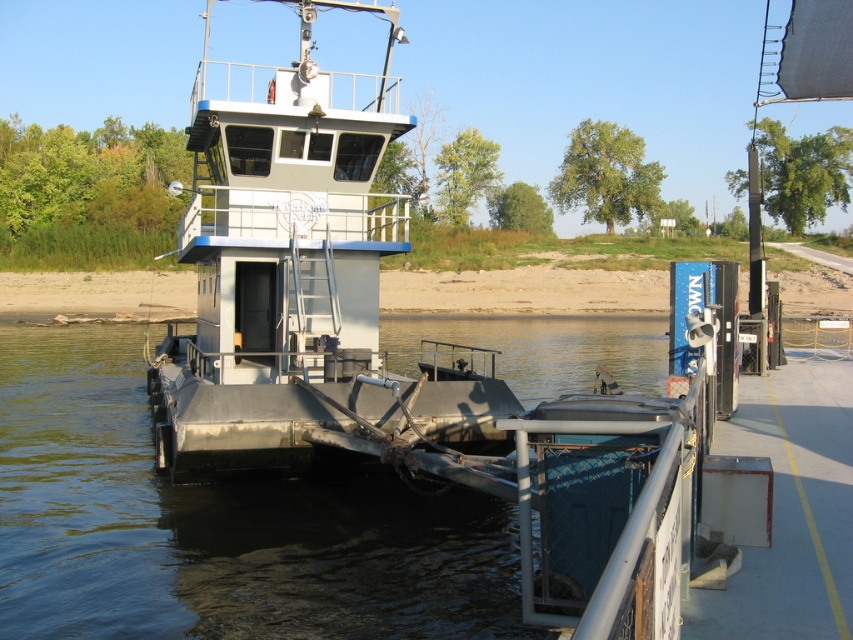
You are standing on the dock and see the metallic water at center and the metallic gray boat at center. Which object is closer to the dock?

The metallic gray boat at center is closer to the dock because the metallic water at center is positioned under it, meaning the boat is above the water and closer to the dock.

Please look at the ferry boat and the dock. There is a point marked at coordinates (x=213, y=524). What is located at that point?

The point at coordinates (x=213, y=524) marks metallic water at center.

You are a passenger on the ferry and want to know if you can safely step from the metallic gray boat at center onto the dock without touching the metallic water at center. Can you do this?

The metallic water at center is not as tall as the metallic gray boat at center, so stepping from the metallic gray boat at center onto the dock is safe as the water level is lower than the boat.